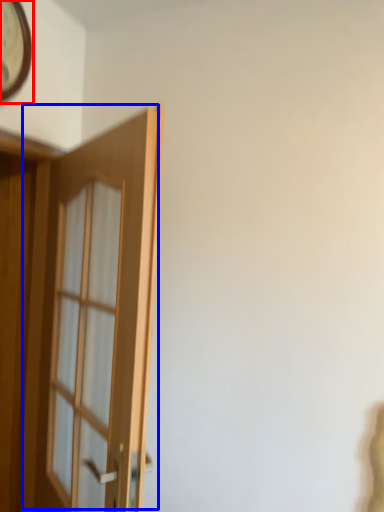
Question: Which point is further to the camera, clock (highlighted by a red box) or door (highlighted by a blue box)?

Choices:
 (A) clock
 (B) door

Answer: (A)